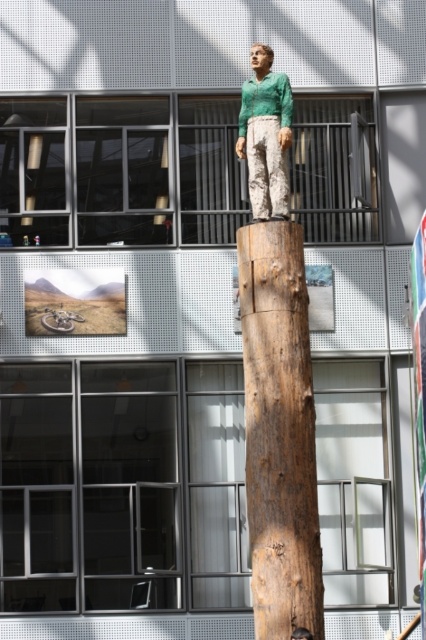
Between brown rough wood at center and green matte shirt at upper center, which one has more height?

With more height is brown rough wood at center.

Does brown rough wood at center have a larger size compared to green matte shirt at upper center?

Correct, brown rough wood at center is larger in size than green matte shirt at upper center.

Image resolution: width=426 pixels, height=640 pixels. What are the coordinates of `brown rough wood at center` in the screenshot? It's located at (279, 432).